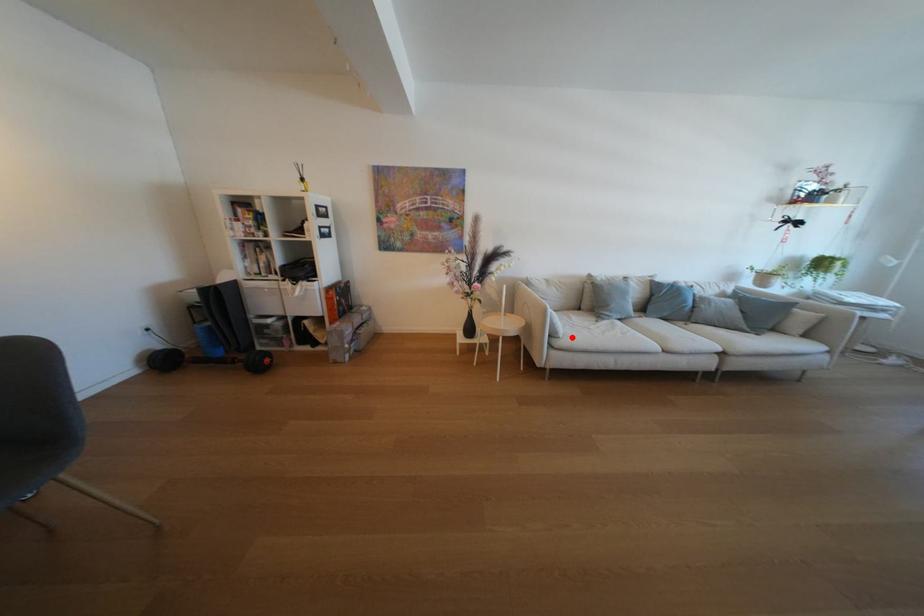
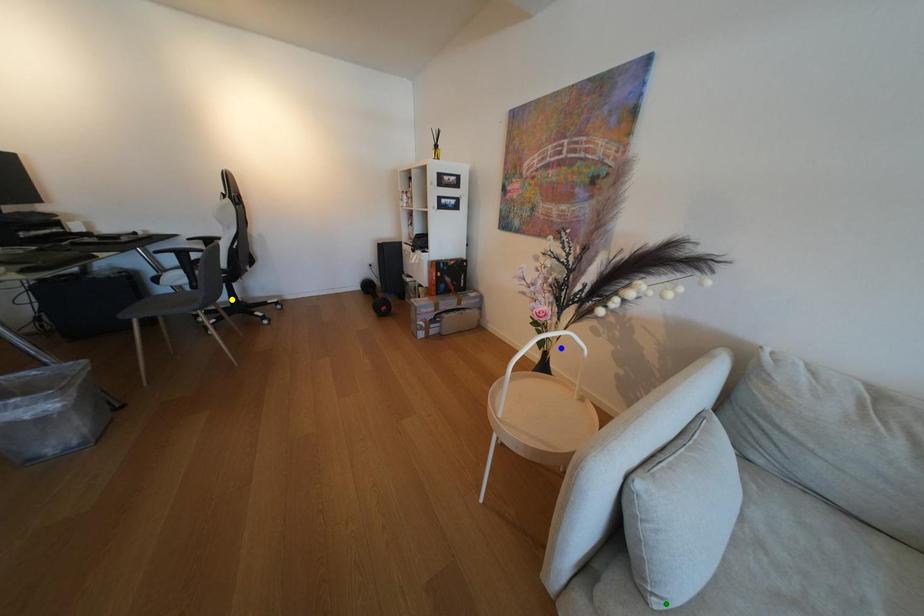
Question: I am providing you with two images of the same scene from different viewpoints. A red point is marked on the first image. You are given multiple points on the second image. In image 2, which mark is for the same physical point as the one in image 1?

Choices:
 (A) yellow point
 (B) blue point
 (C) green point

Answer: (C)